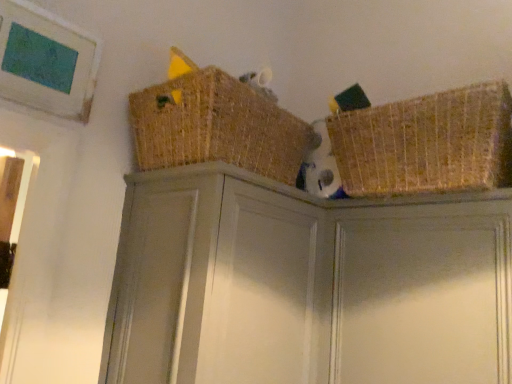
Question: Is matte gray cabinet at center bigger or smaller than woven straw basket at upper center, the second basket in the right-to-left sequence?

Choices:
 (A) big
 (B) small

Answer: (A)

Question: In the image, is matte gray cabinet at center positioned in front of or behind woven straw basket at upper center, the 1th basket positioned from the left?

Choices:
 (A) behind
 (B) front

Answer: (B)

Question: Considering the real-world distances, which object is closest to the matte gray cabinet at center?

Choices:
 (A) matte gray cabinet at upper right
 (B) woven straw basket at upper center, the second basket in the right-to-left sequence
 (C) woven straw basket at upper right, the first basket viewed from the right

Answer: (A)

Question: Which object is positioned farthest from the matte gray cabinet at center?

Choices:
 (A) woven straw basket at upper center, the second basket in the right-to-left sequence
 (B) woven straw basket at upper right, the first basket viewed from the right
 (C) matte gray cabinet at upper right

Answer: (B)